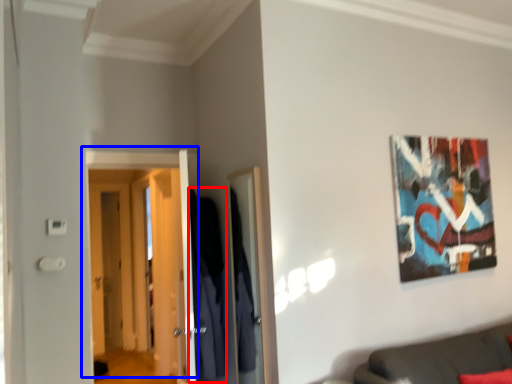
Question: Which object appears closest to the camera in this image, robe (highlighted by a red box) or door (highlighted by a blue box)?

Choices:
 (A) robe
 (B) door

Answer: (A)